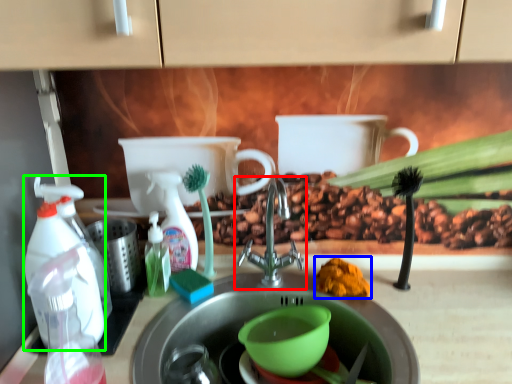
Question: Which object is positioned closest to tap (highlighted by a red box)? Select from debris (highlighted by a blue box) and cleaning product (highlighted by a green box).

Choices:
 (A) debris
 (B) cleaning product

Answer: (A)